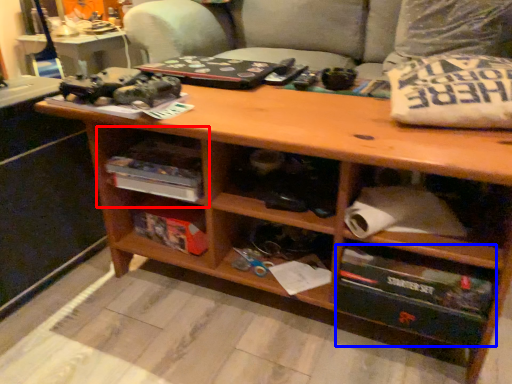
Question: Among these objects, which one is farthest to the camera, shelf (highlighted by a red box) or drawer (highlighted by a blue box)?

Choices:
 (A) shelf
 (B) drawer

Answer: (A)